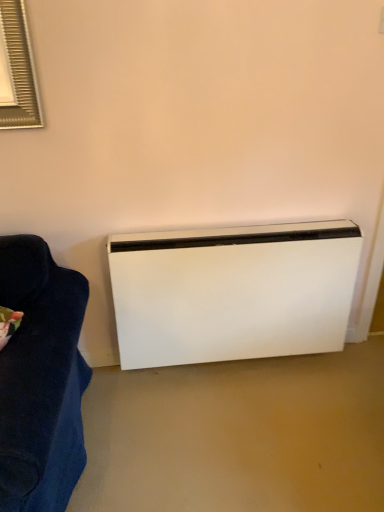
Locate an element on the screen. The image size is (384, 512). dark blue fabric couch at left is located at coordinates (41, 378).

The image size is (384, 512). Describe the element at coordinates (41, 378) in the screenshot. I see `dark blue fabric couch at left` at that location.

Image resolution: width=384 pixels, height=512 pixels. Describe the element at coordinates (232, 292) in the screenshot. I see `white matte heater at lower right` at that location.

The image size is (384, 512). What are the coordinates of `white matte heater at lower right` in the screenshot? It's located at (232, 292).

At what (x,y) coordinates should I click in order to perform the action: click on dark blue fabric couch at left. Please return your answer as a coordinate pair (x, y). The height and width of the screenshot is (512, 384). Looking at the image, I should click on (41, 378).

Is white matte heater at lower right to the left or to the right of dark blue fabric couch at left in the image?

white matte heater at lower right is to the right of dark blue fabric couch at left.

Considering the positions of objects white matte heater at lower right and dark blue fabric couch at left in the image provided, who is behind, white matte heater at lower right or dark blue fabric couch at left?

Positioned behind is white matte heater at lower right.

Between point (259, 340) and point (46, 448), which one is positioned in front?

The point (46, 448) is in front.

In the scene shown: From the image's perspective, does white matte heater at lower right appear lower than dark blue fabric couch at left?

Actually, white matte heater at lower right appears above dark blue fabric couch at left in the image.

From a real-world perspective, which is physically below, white matte heater at lower right or dark blue fabric couch at left?

From a 3D spatial view, white matte heater at lower right is below.

From the picture: Can you confirm if white matte heater at lower right is wider than dark blue fabric couch at left?

Incorrect, the width of white matte heater at lower right does not surpass that of dark blue fabric couch at left.

Who is taller, white matte heater at lower right or dark blue fabric couch at left?

white matte heater at lower right is taller.

Based on the photo, considering the relative sizes of white matte heater at lower right and dark blue fabric couch at left in the image provided, is white matte heater at lower right smaller than dark blue fabric couch at left?

No, white matte heater at lower right is not smaller than dark blue fabric couch at left.

Do you think white matte heater at lower right is within dark blue fabric couch at left, or outside of it?

white matte heater at lower right is not inside dark blue fabric couch at left, it's outside.

Is white matte heater at lower right beside dark blue fabric couch at left?

white matte heater at lower right and dark blue fabric couch at left are clearly separated.

Is white matte heater at lower right oriented away from dark blue fabric couch at left?

No, dark blue fabric couch at left is not at the back of white matte heater at lower right.

What are the coordinates of `furniture in front of the white matte heater at lower right` in the screenshot? It's located at (41, 378).

Which is more to the left, dark blue fabric couch at left or white matte heater at lower right?

Positioned to the left is dark blue fabric couch at left.

Is dark blue fabric couch at left positioned before white matte heater at lower right?

Yes, dark blue fabric couch at left is closer to the camera.

Does point (30, 364) appear closer or farther from the camera than point (277, 256)?

Point (30, 364) appears to be closer to the viewer than point (277, 256).

From the image's perspective, who appears lower, dark blue fabric couch at left or white matte heater at lower right?

dark blue fabric couch at left is shown below in the image.

From a real-world perspective, is dark blue fabric couch at left positioned over white matte heater at lower right based on gravity?

Yes, from a real-world perspective, dark blue fabric couch at left is above white matte heater at lower right.

Which of these two, dark blue fabric couch at left or white matte heater at lower right, is thinner?

white matte heater at lower right is thinner.

Who is taller, dark blue fabric couch at left or white matte heater at lower right?

white matte heater at lower right is taller.

Which of these two, dark blue fabric couch at left or white matte heater at lower right, is smaller?

With smaller size is dark blue fabric couch at left.

Is dark blue fabric couch at left positioned beyond the bounds of white matte heater at lower right?

Yes, dark blue fabric couch at left is outside of white matte heater at lower right.

Is dark blue fabric couch at left positioned far away from white matte heater at lower right?

Actually, dark blue fabric couch at left and white matte heater at lower right are a little close together.

Is dark blue fabric couch at left aimed at white matte heater at lower right?

No, dark blue fabric couch at left is not turned towards white matte heater at lower right.

How different are the orientations of dark blue fabric couch at left and white matte heater at lower right in degrees?

32.6 degrees.

Where is `furniture on the left of white matte heater at lower right`? This screenshot has width=384, height=512. furniture on the left of white matte heater at lower right is located at coordinates (41, 378).

Identify the location of furniture above the white matte heater at lower right (from a real-world perspective). (41, 378).

This screenshot has height=512, width=384. What are the coordinates of `home appliance on the right of dark blue fabric couch at left` in the screenshot? It's located at (232, 292).